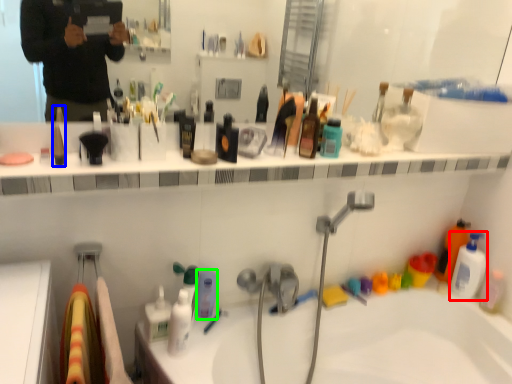
Question: Which object is the closest to the mouthwash (highlighted by a red box)? Choose among these: toiletry (highlighted by a blue box) or toiletry (highlighted by a green box).

Choices:
 (A) toiletry
 (B) toiletry

Answer: (B)